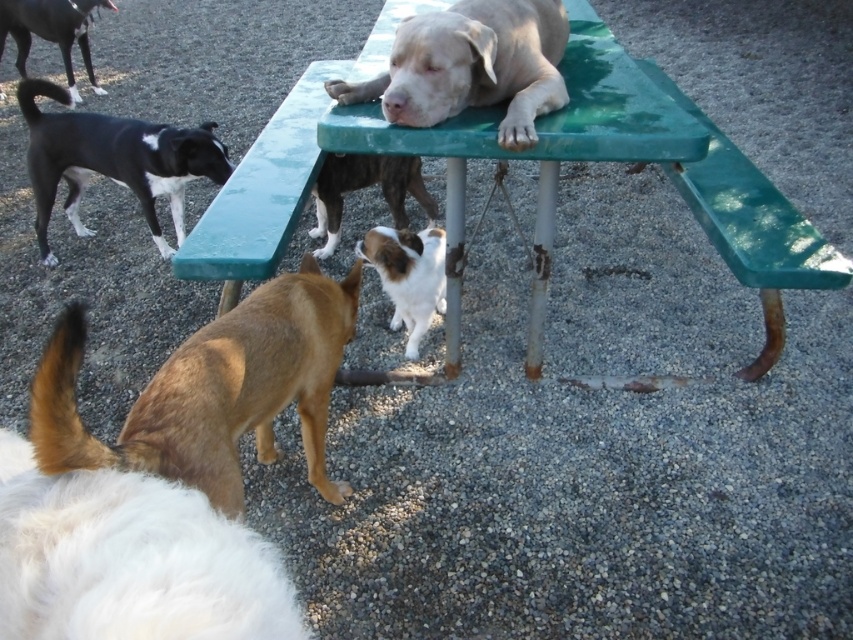
You are standing at the picnic table and want to place a small treat for the dog. The first treat should be placed at point (467, 17) and the second treat at point (334, 243). Which treat will the dog reach first if it starts from its current position on the table?

The dog will reach the treat at point (467, 17) first because it is located in front of point (334, 243), making it closer to the dog.

You are a dog owner who wants to place a small water bowl for your brown fur dog at lower center. The green plastic picnic table at center is in the way. Can you move the table to the side to make space?

The green plastic picnic table at center is above the brown fur dog at lower center, meaning the table is already positioned over the dog. Since the dog is lying on the table, you can move the table to the side to create space for the water bowl.

You are standing in the park and want to take a photo of the green plastic picnic table at center and the white fluffy dog at center. Which object should you focus on first to ensure both are in the frame?

You should focus on the green plastic picnic table at center first because it is closer to the viewer than the white fluffy dog at center, so adjusting the focus starting from the closer object will help capture both in the frame.